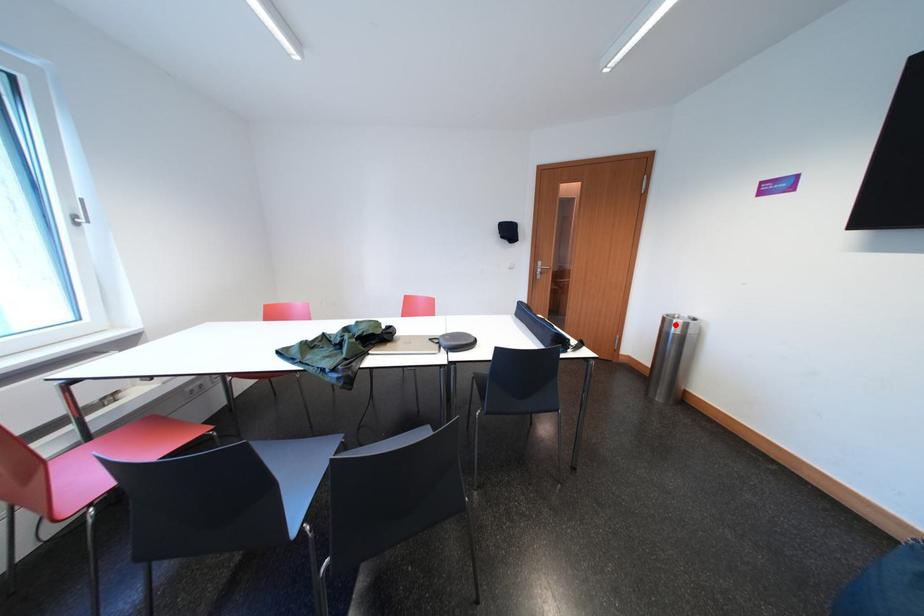
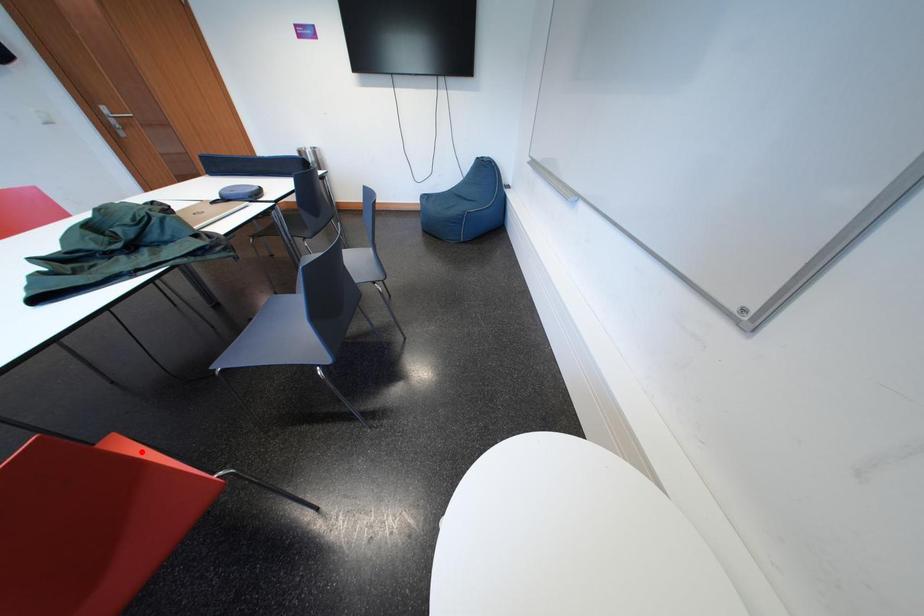
I am providing you with two images of the same scene from different viewpoints. A red point is marked on the first image and another point is marked on the second image. Is the red point in image1 aligned with the point shown in image2?

No